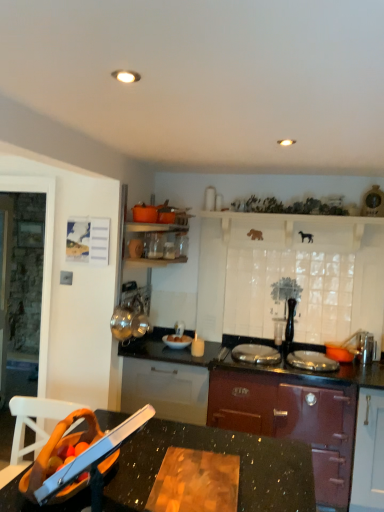
Question: Is black granite countertop at lower center far from white matte cabinet at upper center?

Choices:
 (A) no
 (B) yes

Answer: (B)

Question: Is black granite countertop at lower center facing towards white matte cabinet at upper center?

Choices:
 (A) no
 (B) yes

Answer: (A)

Question: From the image's perspective, is black granite countertop at lower center above white matte cabinet at upper center?

Choices:
 (A) yes
 (B) no

Answer: (B)

Question: Can you confirm if black granite countertop at lower center is taller than white matte cabinet at upper center?

Choices:
 (A) yes
 (B) no

Answer: (A)

Question: Is black granite countertop at lower center at the right side of white matte cabinet at upper center?

Choices:
 (A) no
 (B) yes

Answer: (A)

Question: Considering the positions of matte burgundy stove at center and white matte cabinet at upper center in the image, is matte burgundy stove at center taller or shorter than white matte cabinet at upper center?

Choices:
 (A) short
 (B) tall

Answer: (B)

Question: In the image, is matte burgundy stove at center on the left side or the right side of white matte cabinet at upper center?

Choices:
 (A) left
 (B) right

Answer: (A)

Question: From a real-world perspective, is matte burgundy stove at center physically located above or below white matte cabinet at upper center?

Choices:
 (A) above
 (B) below

Answer: (B)

Question: From the image's perspective, is matte burgundy stove at center above or below white matte cabinet at upper center?

Choices:
 (A) below
 (B) above

Answer: (A)

Question: From a real-world perspective, is black granite countertop at lower center above or below matte burgundy stove at center?

Choices:
 (A) above
 (B) below

Answer: (A)

Question: Do you think black granite countertop at lower center is within matte burgundy stove at center, or outside of it?

Choices:
 (A) outside
 (B) inside

Answer: (A)

Question: Is black granite countertop at lower center taller or shorter than matte burgundy stove at center?

Choices:
 (A) tall
 (B) short

Answer: (B)

Question: In the image, is black granite countertop at lower center on the left side or the right side of matte burgundy stove at center?

Choices:
 (A) right
 (B) left

Answer: (B)

Question: Considering their positions, is black granite countertop at lower center located in front of or behind white glossy bowl at center?

Choices:
 (A) front
 (B) behind

Answer: (A)

Question: Looking at their shapes, would you say black granite countertop at lower center is wider or thinner than white glossy bowl at center?

Choices:
 (A) wide
 (B) thin

Answer: (A)